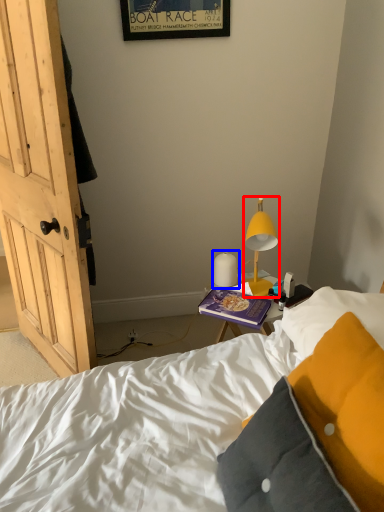
Question: Which object appears closest to the camera in this image, lamp (highlighted by a red box) or lamp (highlighted by a blue box)?

Choices:
 (A) lamp
 (B) lamp

Answer: (A)